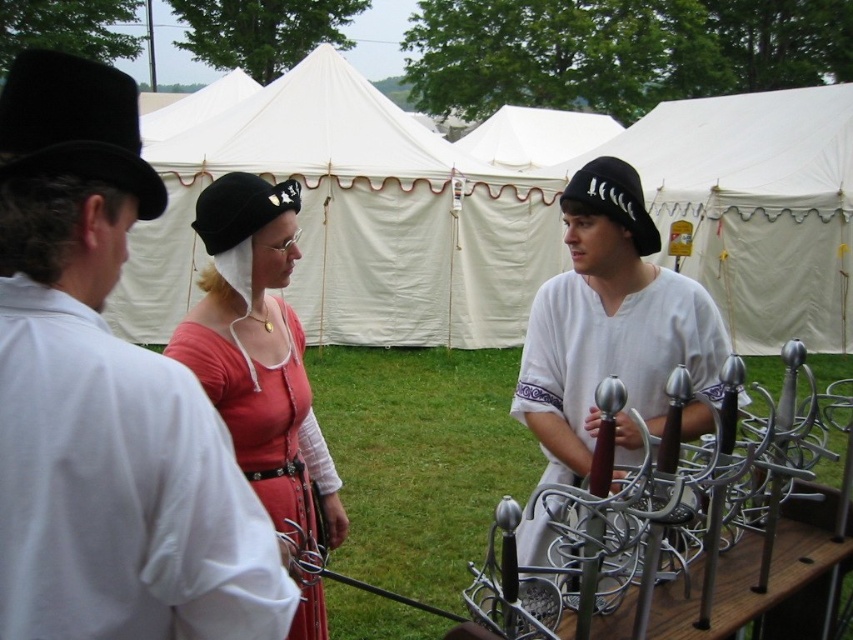
Who is higher up, white canvas tent at center or white matte shirt at center?

white canvas tent at center is above.

I want to click on white canvas tent at center, so click(x=508, y=214).

Does point (26, 52) come in front of point (277, 422)?

Yes.

Consider the image. Which of these two, white matte shirt at left or matte red dress at center, stands taller?

Standing taller between the two is matte red dress at center.

Which is in front, point (12, 93) or point (286, 259)?

Positioned in front is point (12, 93).

Identify the location of white matte shirt at left. (105, 397).

Who is taller, white matte shirt at left or white matte shirt at center?

Standing taller between the two is white matte shirt at center.

Between point (26, 456) and point (631, 460), which one is positioned behind?

The point (631, 460) is more distant.

Identify the location of white matte shirt at left. Image resolution: width=853 pixels, height=640 pixels. (105, 397).